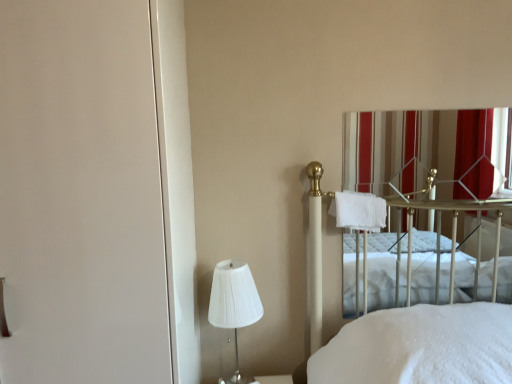
Question: Can you confirm if white pleated fabric lampshade at lower left is wider than white soft towel at center-right?

Choices:
 (A) yes
 (B) no

Answer: (A)

Question: Could you tell me if white pleated fabric lampshade at lower left is turned towards white soft towel at center-right?

Choices:
 (A) yes
 (B) no

Answer: (B)

Question: Are white pleated fabric lampshade at lower left and white soft towel at center-right far apart?

Choices:
 (A) yes
 (B) no

Answer: (B)

Question: Can you confirm if white pleated fabric lampshade at lower left is bigger than white soft towel at center-right?

Choices:
 (A) yes
 (B) no

Answer: (A)

Question: Does white pleated fabric lampshade at lower left appear on the right side of white soft towel at center-right?

Choices:
 (A) yes
 (B) no

Answer: (B)

Question: In terms of size, does white matte screen door at left appear bigger or smaller than striped fabric curtain at upper right?

Choices:
 (A) small
 (B) big

Answer: (B)

Question: Considering their positions, is white matte screen door at left located in front of or behind striped fabric curtain at upper right?

Choices:
 (A) behind
 (B) front

Answer: (B)

Question: Is white matte screen door at left inside the boundaries of striped fabric curtain at upper right, or outside?

Choices:
 (A) inside
 (B) outside

Answer: (B)

Question: From the image's perspective, is white matte screen door at left positioned above or below striped fabric curtain at upper right?

Choices:
 (A) above
 (B) below

Answer: (B)

Question: Based on their sizes in the image, would you say striped fabric curtain at upper right is bigger or smaller than white matte screen door at left?

Choices:
 (A) big
 (B) small

Answer: (B)

Question: Is striped fabric curtain at upper right wider or thinner than white matte screen door at left?

Choices:
 (A) wide
 (B) thin

Answer: (B)

Question: In terms of height, does striped fabric curtain at upper right look taller or shorter compared to white matte screen door at left?

Choices:
 (A) tall
 (B) short

Answer: (B)

Question: From a real-world perspective, is striped fabric curtain at upper right physically located above or below white matte screen door at left?

Choices:
 (A) below
 (B) above

Answer: (A)

Question: From a real-world perspective, is white pleated fabric lampshade at lower left physically located above or below white soft towel at center-right?

Choices:
 (A) above
 (B) below

Answer: (B)

Question: Visually, is white pleated fabric lampshade at lower left positioned to the left or to the right of white soft towel at center-right?

Choices:
 (A) left
 (B) right

Answer: (A)